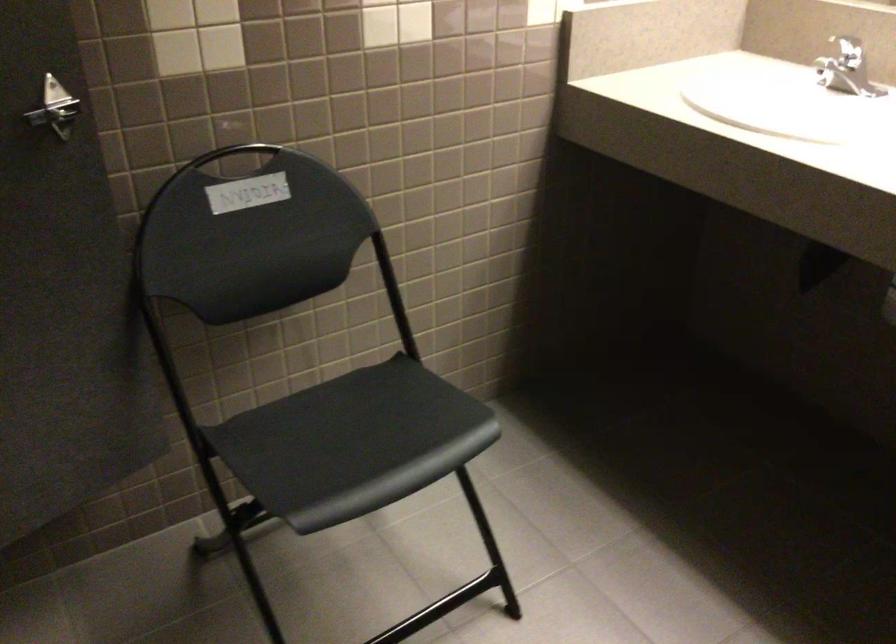
Locate an element on the screen. black chair sitting surface is located at coordinates (352, 442).